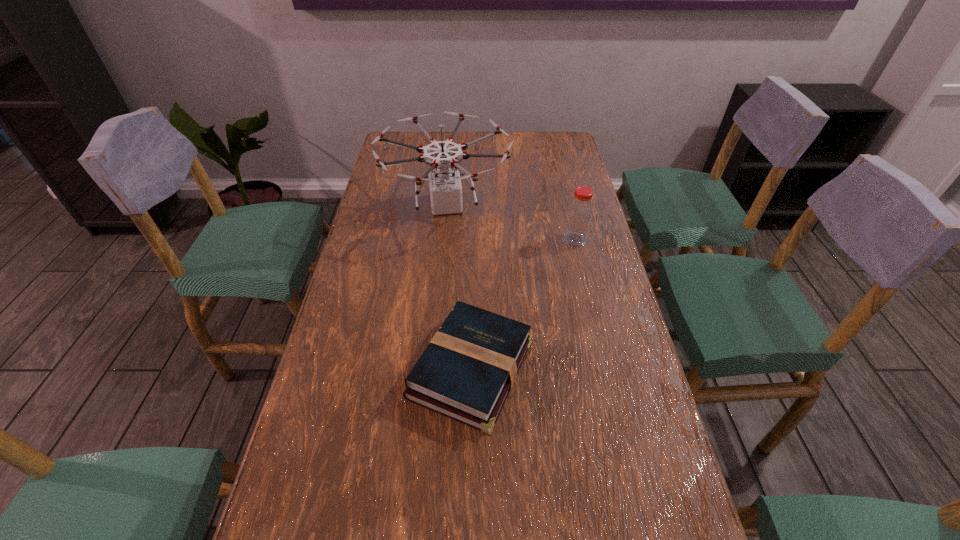
Locate an element on the screen. drone is located at coordinates (445, 185).

Locate an element on the screen. The height and width of the screenshot is (540, 960). the second shortest object is located at coordinates (579, 215).

Find the location of a particular element. The image size is (960, 540). the rightmost object is located at coordinates (579, 215).

Locate an element on the screen. This screenshot has width=960, height=540. hardback book is located at coordinates (466, 372).

At what (x,y) coordinates should I click in order to perform the action: click on the nearest object. Please return your answer as a coordinate pair (x, y). Looking at the image, I should click on (466, 372).

Locate an element on the screen. The image size is (960, 540). vacant space located 0.060m on the right of the drone is located at coordinates (528, 205).

Where is `free location located 0.300m on the back of the rightmost object`? The width and height of the screenshot is (960, 540). free location located 0.300m on the back of the rightmost object is located at coordinates (561, 179).

Identify the location of free point located 0.250m on the right of the hardback book. (643, 369).

The width and height of the screenshot is (960, 540). I want to click on object positioned at the left edge, so click(x=445, y=185).

At what (x,y) coordinates should I click in order to perform the action: click on object that is at the right edge. Please return your answer as a coordinate pair (x, y). This screenshot has height=540, width=960. Looking at the image, I should click on (579, 215).